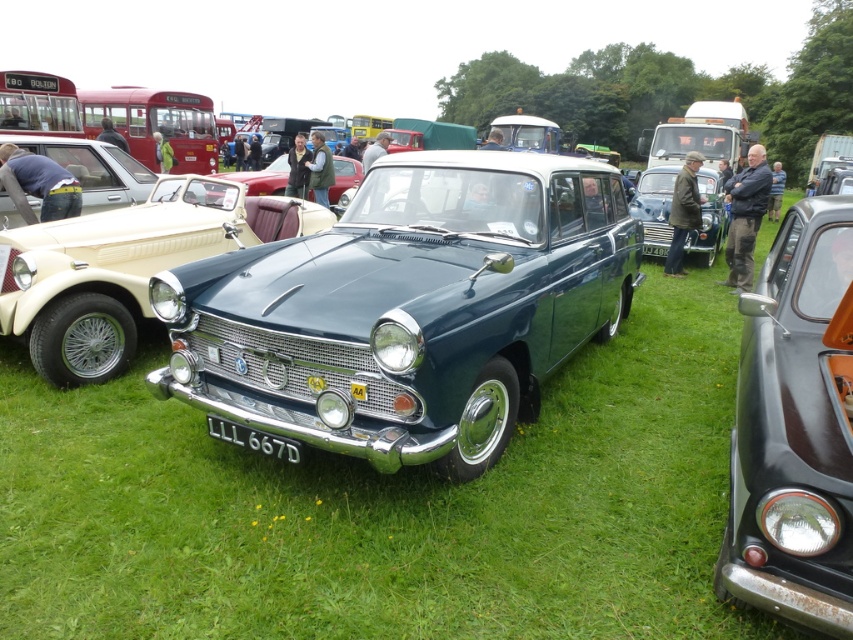
You are a photographer trying to capture a wide shot of the car show. You have a camera that can only fit objects within a 10m width. The shiny black car at right is positioned 8 meters away from the metallic red car at center. Can you fit both cars in your shot without moving your camera?

The shiny black car at right is bigger than the metallic red car at center. Since they are 8 meters apart, and your camera can capture up to 10 meters width, yes, both cars can fit within the camera frame as the distance between them is within the 10m limit.

You are a photographer trying to capture the metallic blue sedan at center and the black plastic license plate at center in a single shot. Since you want both objects to be clearly visible, which one should you adjust your camera angle to focus on first?

The metallic blue sedan at center is to the right of the black plastic license plate at center. To capture both in a single shot, you should adjust your camera angle to focus on the black plastic license plate at center first, as it is positioned to the left of the metallic blue sedan at center.

You are a photographer trying to capture a photo of the shiny blue car at center without the shiny black car at right blocking the view. Based on their heights, is it possible to position yourself lower to the ground so the blue car is visible above the black car?

The shiny black car at right is taller than the shiny blue car at center. Lowering your position might not help because the taller shiny black car at right could still block the view of the shiny blue car at center.